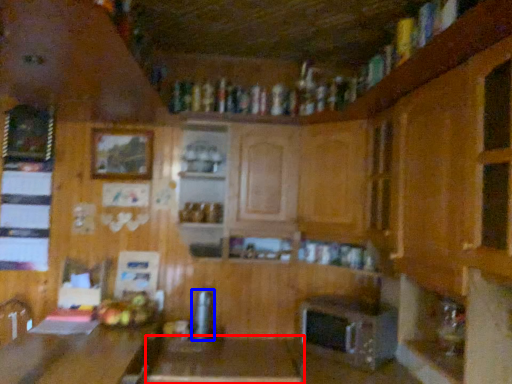
Question: Which point is closer to the camera, table (highlighted by a red box) or appliance (highlighted by a blue box)?

Choices:
 (A) table
 (B) appliance

Answer: (A)